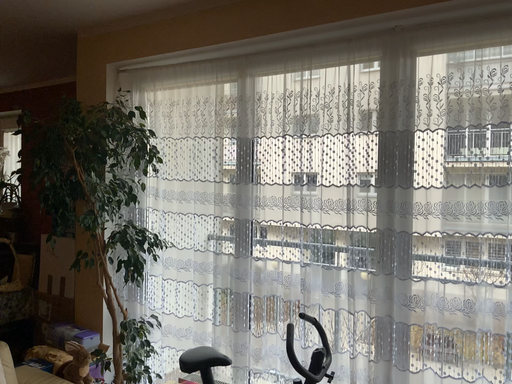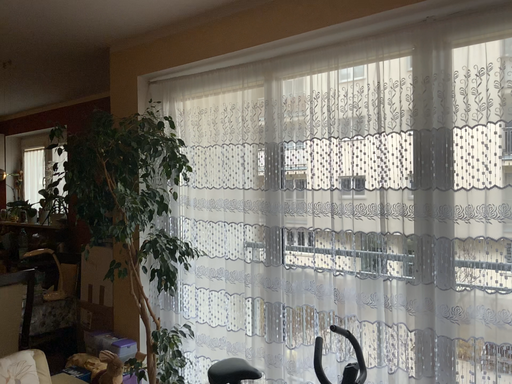
Question: Which way did the camera rotate in the video?

Choices:
 (A) rotated left
 (B) rotated right

Answer: (A)